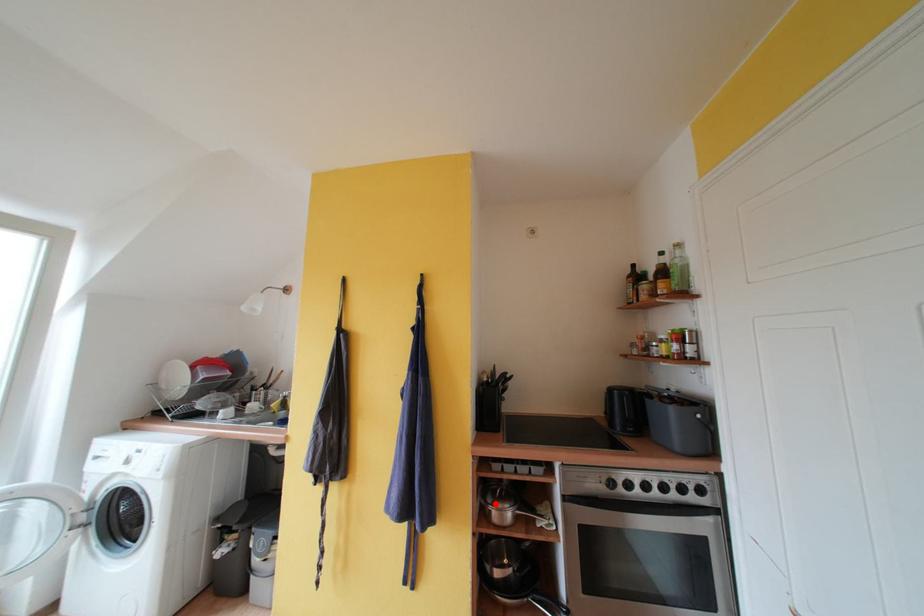
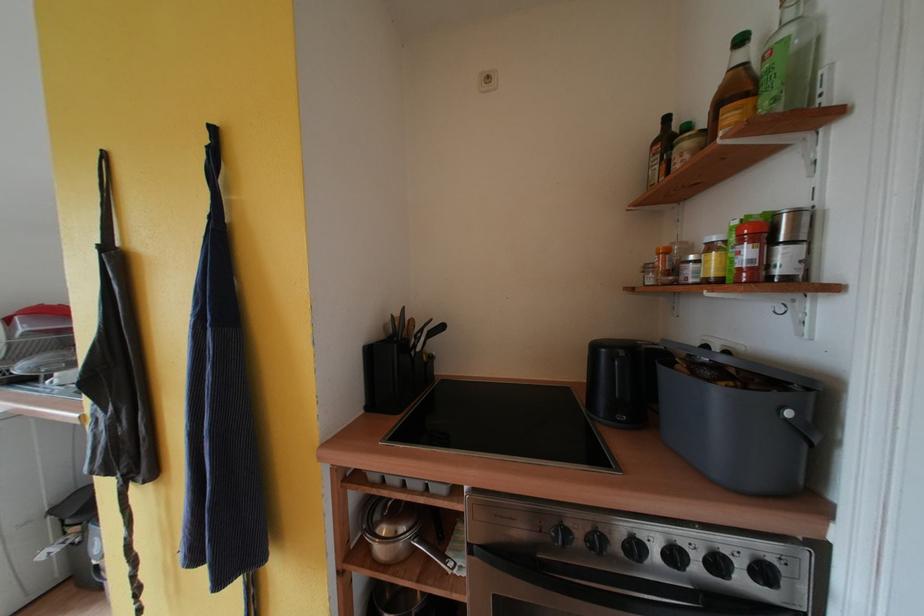
Question: I am providing you with two images of the same scene from different viewpoints. A red point is marked on the first image. Is the red point's position out of view in image 2?

Choices:
 (A) Yes
 (B) No

Answer: (B)